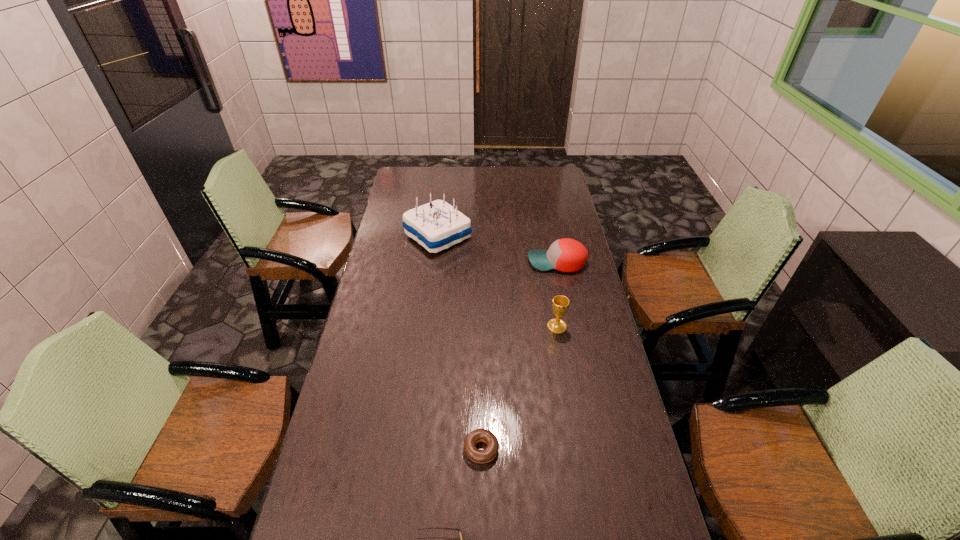
Locate an element on the screen. This screenshot has width=960, height=540. empty space that is in between the birthday cake and the third shortest object is located at coordinates (497, 249).

Locate an element on the screen. free spot between the baseball cap and the second shortest object is located at coordinates (519, 356).

In order to click on vacant area that lies between the fourth shortest object and the fourth tallest object in this screenshot , I will do `click(519, 388)`.

Find the location of a particular element. This screenshot has height=540, width=960. vacant area that lies between the third shortest object and the doughnut is located at coordinates (519, 356).

The image size is (960, 540). I want to click on unoccupied position between the tallest object and the fourth tallest object, so click(460, 343).

Select which object is the second closest to the second nearest object. Please provide its 2D coordinates. Your answer should be formatted as a tuple, i.e. [(x, y)], where the tuple contains the x and y coordinates of a point satisfying the conditions above.

[(560, 303)]

This screenshot has width=960, height=540. Find the location of `object that is the third closest one to the birthday cake`. object that is the third closest one to the birthday cake is located at coordinates (489, 453).

The width and height of the screenshot is (960, 540). What are the coordinates of `free spot that satisfies the following two spatial constraints: 1. on the front side of the second shortest object; 2. on the left side of the birthday cake` in the screenshot? It's located at (413, 449).

You are a GUI agent. You are given a task and a screenshot of the screen. Output one action in this format:
    pyautogui.click(x=<x>, y=<y>)
    Task: Click on the vacant space that satisfies the following two spatial constraints: 1. at the brim of the third tallest object; 2. on the front side of the third farthest object
    The width and height of the screenshot is (960, 540).
    Given the screenshot: What is the action you would take?
    pyautogui.click(x=570, y=327)

Where is `free space that satisfies the following two spatial constraints: 1. at the brim of the baseball cap; 2. on the front side of the fourth farthest object`? The width and height of the screenshot is (960, 540). free space that satisfies the following two spatial constraints: 1. at the brim of the baseball cap; 2. on the front side of the fourth farthest object is located at coordinates (594, 449).